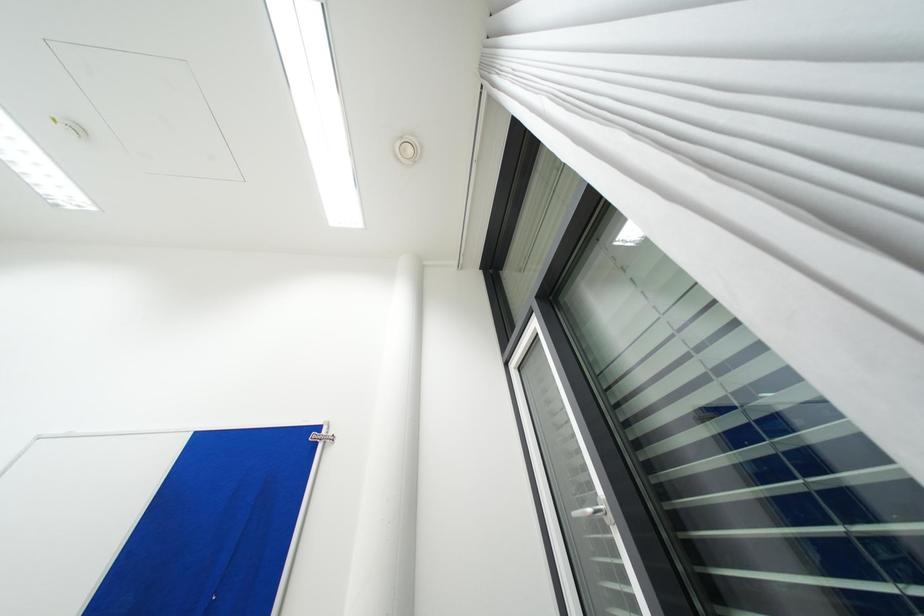
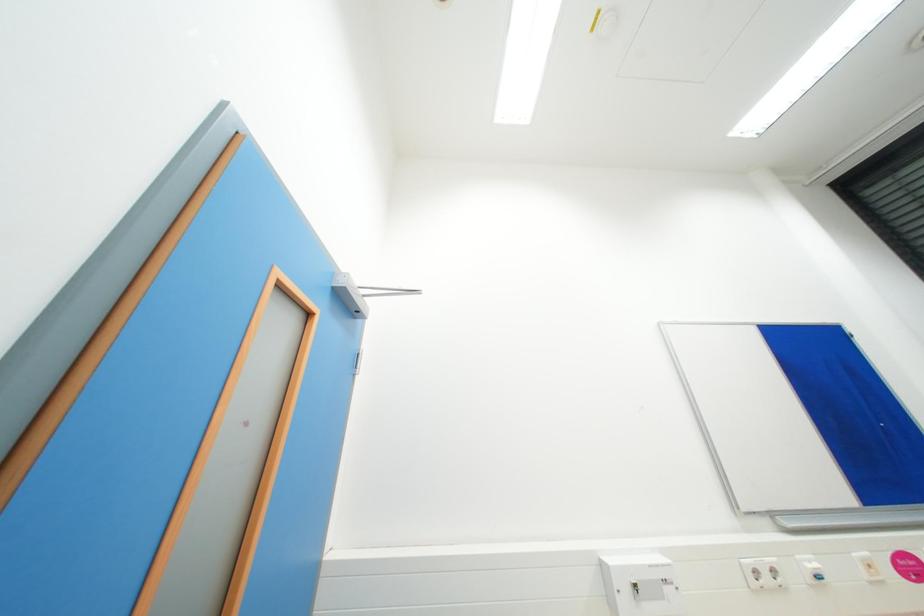
Question: What movement of the cameraman would produce the second image?

Choices:
 (A) Left
 (B) Right
 (C) Forward
 (D) Backward

Answer: (A)